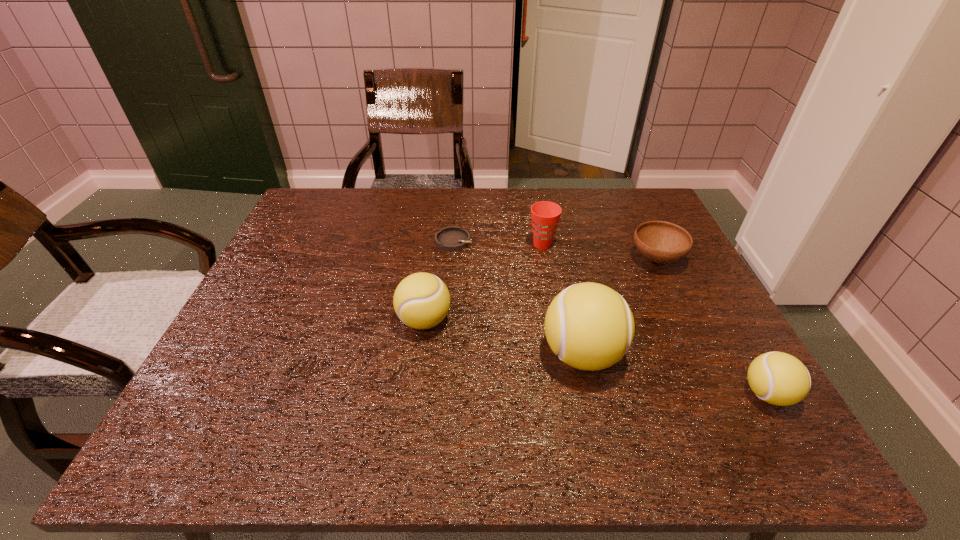
Please point a vacant point for placing a tennis ball on the left. Please provide its 2D coordinates. Your answer should be formatted as a tuple, i.e. [(x, y)], where the tuple contains the x and y coordinates of a point satisfying the conditions above.

[(288, 291)]